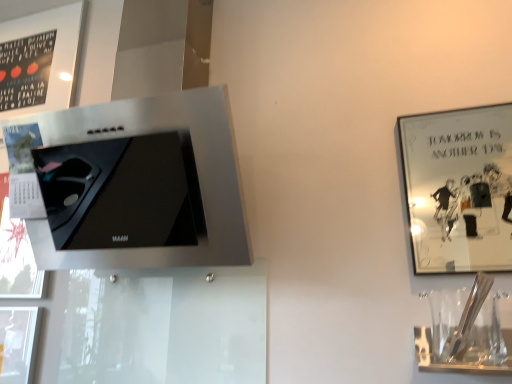
Question: Is metallic silver picture frame at upper right, marked as the 2th picture frame in a top-to-bottom arrangement, further to the viewer compared to matte black frame at upper left, which ranks as the first picture frame in top-to-bottom order?

Choices:
 (A) no
 (B) yes

Answer: (A)

Question: Is metallic silver picture frame at upper right, marked as the 1th picture frame in a bottom-to-top arrangement, looking in the opposite direction of matte black frame at upper left, arranged as the 2th picture frame when viewed from the right?

Choices:
 (A) yes
 (B) no

Answer: (B)

Question: From a real-world perspective, is metallic silver picture frame at upper right, which is the second picture frame in left-to-right order, beneath matte black frame at upper left, arranged as the 2th picture frame when viewed from the right?

Choices:
 (A) yes
 (B) no

Answer: (A)

Question: From the image's perspective, does metallic silver picture frame at upper right, which is the second picture frame in left-to-right order, appear lower than matte black frame at upper left, arranged as the 2th picture frame when viewed from the right?

Choices:
 (A) yes
 (B) no

Answer: (A)

Question: Is metallic silver picture frame at upper right, the 1th picture frame from the front, completely or partially outside of matte black frame at upper left, positioned as the second picture frame in bottom-to-top order?

Choices:
 (A) yes
 (B) no

Answer: (A)

Question: Is satin silver range hood at upper left to the left or to the right of matte black frame at upper left, which is the 2th picture frame in front-to-back order, in the image?

Choices:
 (A) right
 (B) left

Answer: (A)

Question: Is satin silver range hood at upper left situated inside matte black frame at upper left, positioned as the second picture frame in bottom-to-top order, or outside?

Choices:
 (A) inside
 (B) outside

Answer: (B)

Question: From the image's perspective, is satin silver range hood at upper left positioned above or below matte black frame at upper left, arranged as the 2th picture frame when viewed from the right?

Choices:
 (A) above
 (B) below

Answer: (B)

Question: Considering their positions, is satin silver range hood at upper left located in front of or behind matte black frame at upper left, which is the 2th picture frame in front-to-back order?

Choices:
 (A) behind
 (B) front

Answer: (B)

Question: Is matte black frame at upper left, positioned as the second picture frame in bottom-to-top order, bigger or smaller than clear glass wine glass at lower right?

Choices:
 (A) small
 (B) big

Answer: (B)

Question: From a real-world perspective, relative to clear glass wine glass at lower right, is matte black frame at upper left, which ranks as the first picture frame in top-to-bottom order, vertically above or below?

Choices:
 (A) above
 (B) below

Answer: (A)

Question: Does point (23, 102) appear closer or farther from the camera than point (507, 345)?

Choices:
 (A) farther
 (B) closer

Answer: (A)

Question: Is matte black frame at upper left, which ranks as the first picture frame in top-to-bottom order, wider or thinner than clear glass wine glass at lower right?

Choices:
 (A) thin
 (B) wide

Answer: (A)

Question: Considering the positions of clear glass wine glass at lower right and metallic silver picture frame at upper right, which is the second picture frame in left-to-right order, in the image, is clear glass wine glass at lower right taller or shorter than metallic silver picture frame at upper right, which is the second picture frame in left-to-right order,?

Choices:
 (A) tall
 (B) short

Answer: (B)

Question: Does point click(x=448, y=331) appear closer or farther from the camera than point click(x=415, y=122)?

Choices:
 (A) closer
 (B) farther

Answer: (A)